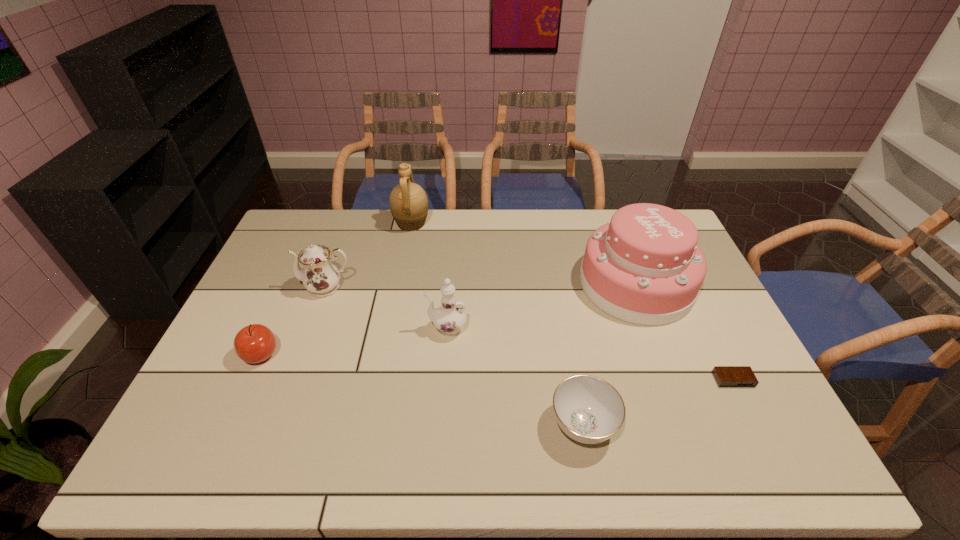
At what (x,y) coordinates should I click in order to perform the action: click on pitcher. Please return your answer as a coordinate pair (x, y). Looking at the image, I should click on (408, 202).

Locate an element on the screen. The width and height of the screenshot is (960, 540). the third object from left to right is located at coordinates (408, 202).

At what (x,y) coordinates should I click in order to perform the action: click on birthday cake. Please return your answer as a coordinate pair (x, y). Looking at the image, I should click on (644, 267).

The width and height of the screenshot is (960, 540). Identify the location of the second chinaware from left to right. (450, 316).

Where is `the second nearest chinaware`? the second nearest chinaware is located at coordinates (x=450, y=316).

Locate an element on the screen. the leftmost chinaware is located at coordinates (319, 276).

Locate an element on the screen. Image resolution: width=960 pixels, height=540 pixels. apple is located at coordinates pyautogui.click(x=255, y=343).

What are the coordinates of `the second shortest object` in the screenshot? It's located at (588, 409).

The image size is (960, 540). I want to click on the nearest object, so point(588,409).

What are the coordinates of `alarm clock` in the screenshot? It's located at (726, 376).